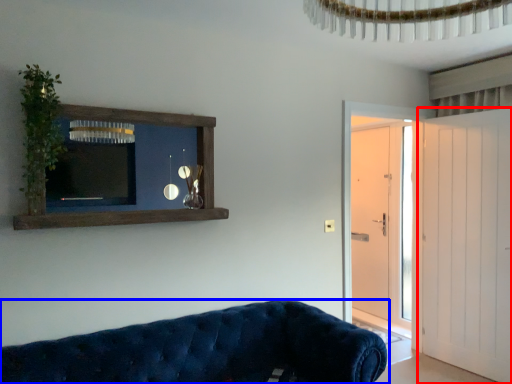
Question: Which of the following is the farthest to the observer, door (highlighted by a red box) or studio couch (highlighted by a blue box)?

Choices:
 (A) door
 (B) studio couch

Answer: (A)